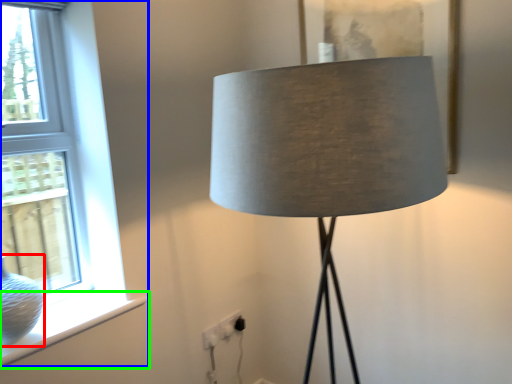
Question: Which is farther away from glass vase (highlighted by a red box)? window (highlighted by a blue box) or window sill (highlighted by a green box)?

Choices:
 (A) window
 (B) window sill

Answer: (A)